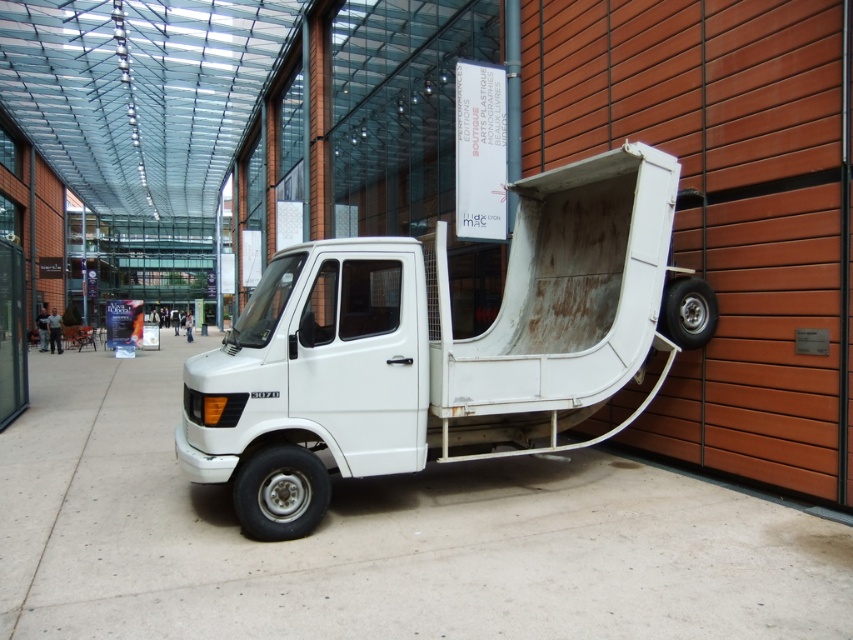
You are a delivery person who needs to park your 2.5 meter wide truck in this area. The white matte truck at center is already parked. Can you safely park your truck next to the gray concrete pavement at center without overlapping?

The gray concrete pavement at center is wider than the white matte truck at center, so there should be enough space to park your 2.5 meter wide truck next to the gray concrete pavement at center without overlapping.

You are standing in the middle of the gray concrete pavement at center and want to walk towards the white matte truck at center. Which direction should you face to move directly towards it?

Since the gray concrete pavement at center is in front of the white matte truck at center, you should face backward to move directly towards the white matte truck at center.

You are a delivery person trying to unload packages from the white matte truck at center. You notice the gray concrete pavement at center. Is the pavement a suitable surface to place the packages on?

The gray concrete pavement at center is positioned under the white matte truck at center, so it is a suitable surface to place the packages on since it is directly beneath the truck.